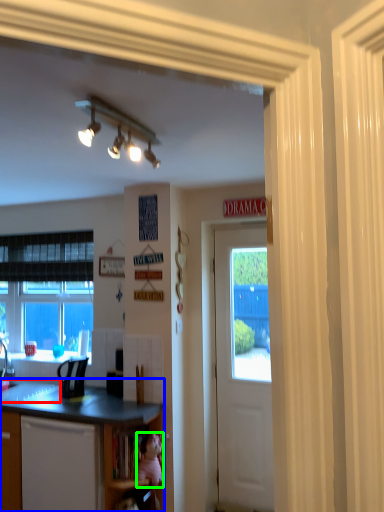
Question: Which object is positioned closest to sink (highlighted by a red box)? Select from countertop (highlighted by a blue box) and teddy bear (highlighted by a green box).

Choices:
 (A) countertop
 (B) teddy bear

Answer: (A)